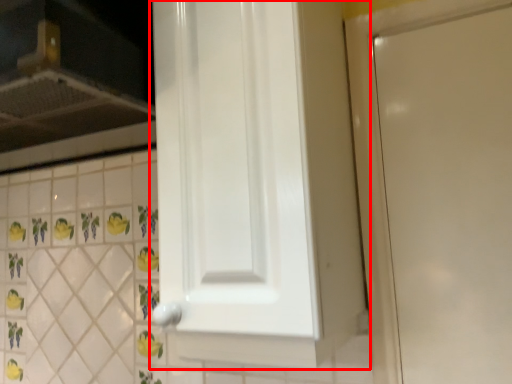
Question: In this image, where is door (annotated by the red box) located relative to vent?

Choices:
 (A) right
 (B) left

Answer: (A)